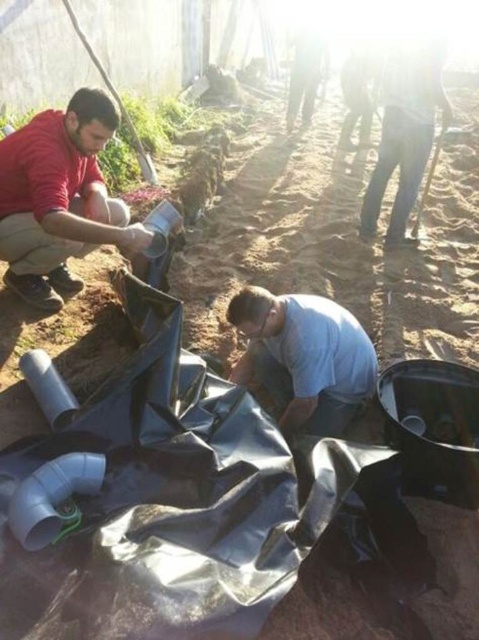
You are standing in the outdoor scene and want to know which of the two points, point (305, 429) or point (398, 84), is closer to you. Can you determine this based on the image?

Point (305, 429) is closer to the camera than point (398, 84), so it is closer to you.

From the picture: You are a construction worker observing the scene. There is a matte red shirt at upper left and a dark blue jeans at right. Which clothing item is closer to you?

The matte red shirt at upper left is closer to you because it is in front of dark blue jeans at right.